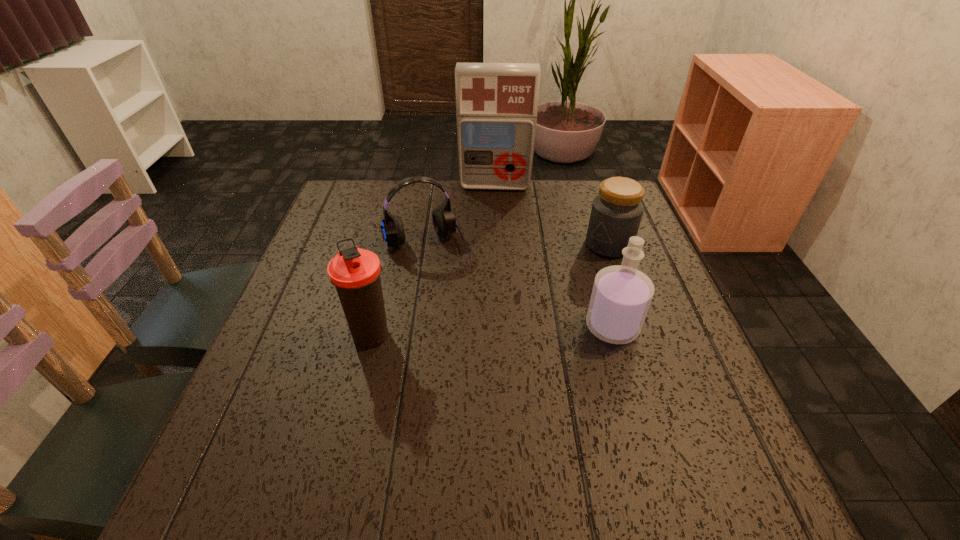
You are a GUI agent. You are given a task and a screenshot of the screen. Output one action in this format:
    pyautogui.click(x=<x>, y=<y>)
    Task: Click on the free space at the far edge of the desktop
    
    Given the screenshot: What is the action you would take?
    pyautogui.click(x=474, y=202)

The image size is (960, 540). Identify the location of vacant space at the left edge of the desktop. (336, 342).

Image resolution: width=960 pixels, height=540 pixels. In the image, there is a desktop. Identify the location of vacant space at the right edge. click(643, 335).

Locate an element on the screen. The image size is (960, 540). free location at the far left corner of the desktop is located at coordinates [x=364, y=223].

Locate an element on the screen. The width and height of the screenshot is (960, 540). free space at the near right corner is located at coordinates (673, 414).

Locate an element on the screen. This screenshot has height=540, width=960. vacant region between the jar and the farthest object is located at coordinates (552, 215).

Where is `free spot between the jar and the headset`? The width and height of the screenshot is (960, 540). free spot between the jar and the headset is located at coordinates (517, 245).

Where is `unoccupied area between the headset and the thermos bottle`? unoccupied area between the headset and the thermos bottle is located at coordinates coord(399,291).

Find the location of a particular element. Image resolution: width=960 pixels, height=540 pixels. empty space that is in between the farthest object and the perfume is located at coordinates (554, 256).

This screenshot has width=960, height=540. I want to click on vacant area that lies between the perfume and the tallest object, so click(x=554, y=256).